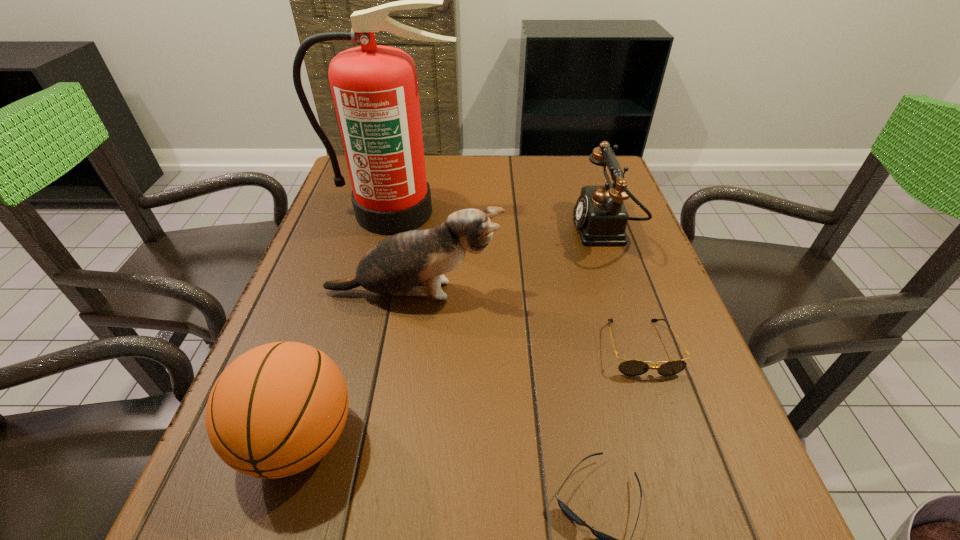
Where is `blank area located 0.350m on the front of the telephone at the rotary dial`? The image size is (960, 540). blank area located 0.350m on the front of the telephone at the rotary dial is located at coordinates (442, 230).

You are a GUI agent. You are given a task and a screenshot of the screen. Output one action in this format:
    pyautogui.click(x=<x>, y=<y>)
    Task: Click on the vacant space located on the right of the basketball
    Image resolution: width=960 pixels, height=540 pixels.
    Given the screenshot: What is the action you would take?
    pyautogui.click(x=442, y=439)

This screenshot has height=540, width=960. Find the location of `free space located 0.170m on the lenses of the farther sunglasses`. free space located 0.170m on the lenses of the farther sunglasses is located at coordinates (681, 469).

You are a GUI agent. You are given a task and a screenshot of the screen. Output one action in this format:
    pyautogui.click(x=<x>, y=<y>)
    Task: Click on the object situated at the far edge
    The height and width of the screenshot is (540, 960).
    Given the screenshot: What is the action you would take?
    pyautogui.click(x=374, y=88)

Locate an element on the screen. This screenshot has width=960, height=540. object at the near edge is located at coordinates (276, 410).

You are a GUI agent. You are given a task and a screenshot of the screen. Output one action in this format:
    pyautogui.click(x=<x>, y=<y>)
    Task: Click on the fire extinguisher that is at the left edge
    The height and width of the screenshot is (540, 960).
    Given the screenshot: What is the action you would take?
    pyautogui.click(x=374, y=88)

Locate an element on the screen. cat located in the left edge section of the desktop is located at coordinates (394, 266).

The image size is (960, 540). I want to click on basketball present at the left edge, so click(x=276, y=410).

I want to click on telephone that is positioned at the right edge, so click(x=600, y=215).

Where is `sunglasses located in the right edge section of the desktop`? This screenshot has width=960, height=540. sunglasses located in the right edge section of the desktop is located at coordinates (629, 367).